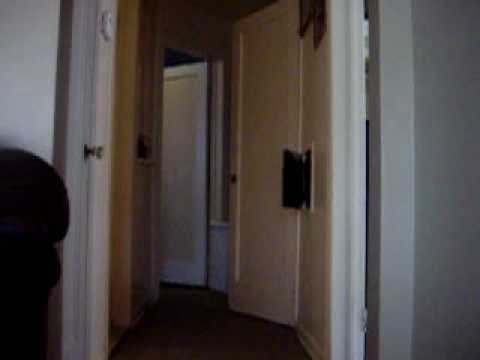
At what (x,y) coordinates should I click in order to perform the action: click on wall. Please return your answer as a coordinate pair (x, y). Looking at the image, I should click on (192, 34).